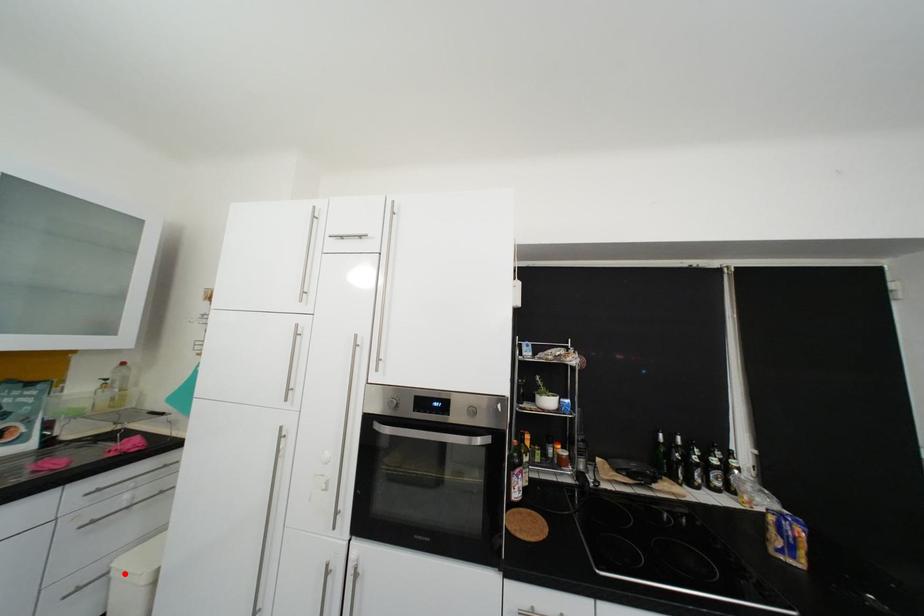
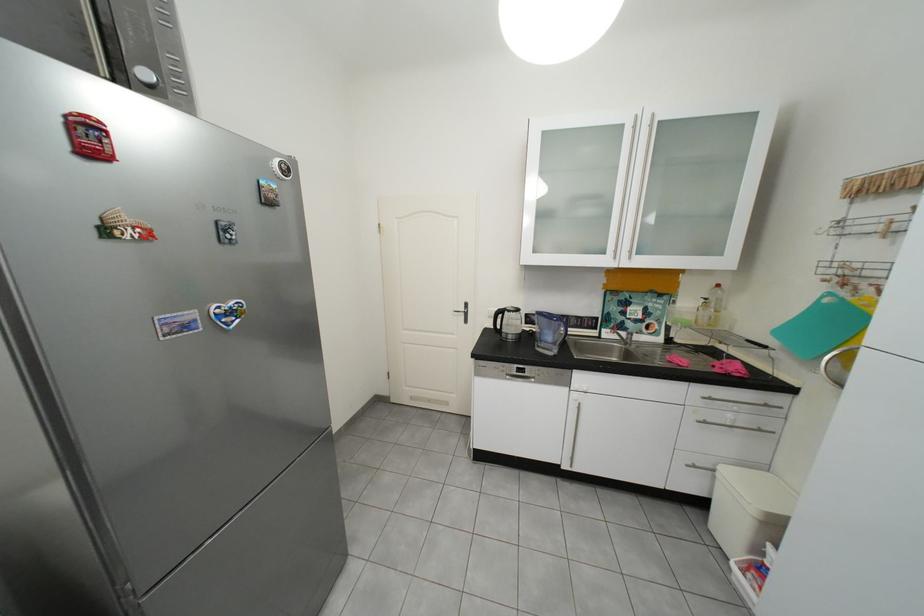
Where in the second image is the point corresponding to the highlighted location from the first image?

(730, 476)